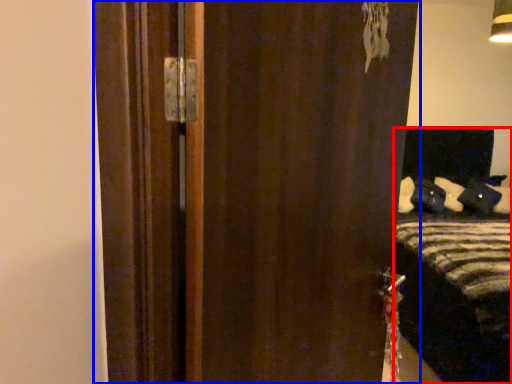
Question: Which object is further to the camera taking this photo, bed (highlighted by a red box) or door (highlighted by a blue box)?

Choices:
 (A) bed
 (B) door

Answer: (A)